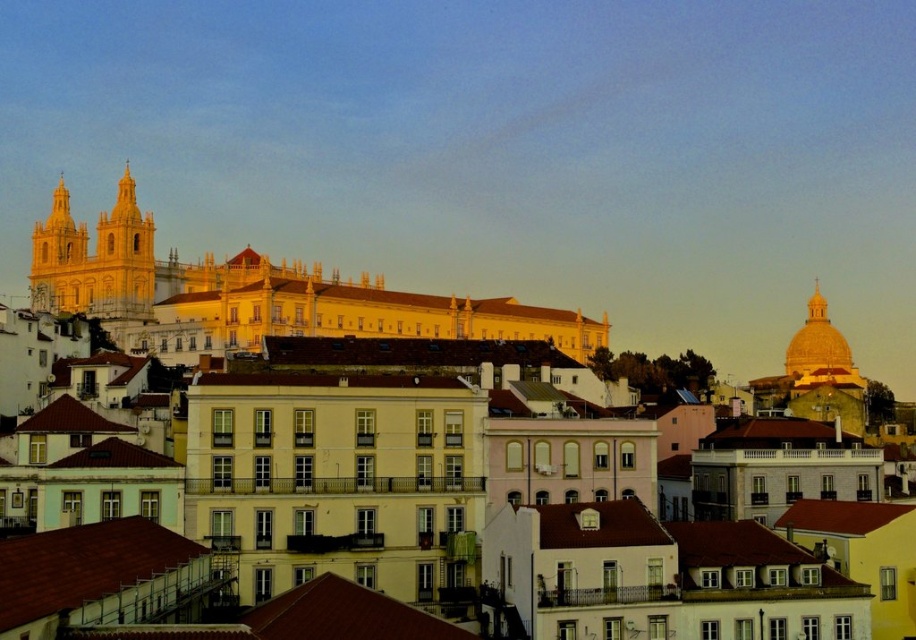
You are an architect analyzing the urban landscape. Based on the scene, which of the two golden structures, the golden stone church at left or the golden dome at upper right, has a greater vertical height?

The golden stone church at left is taller than the golden dome at upper right, so the golden stone church at left has a greater vertical height.